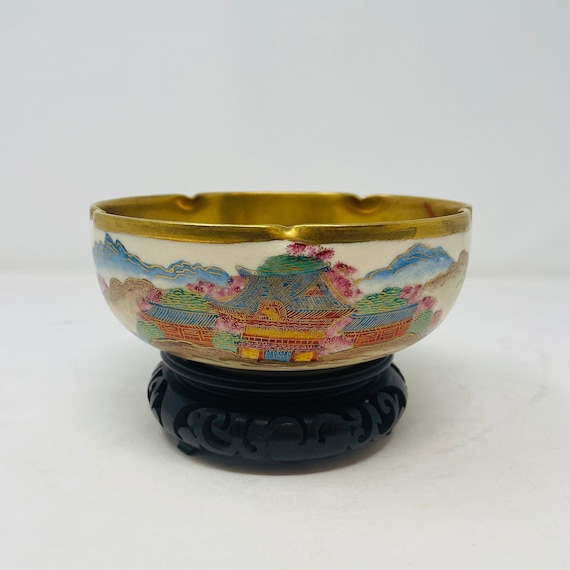
You are a GUI agent. You are given a task and a screenshot of the screen. Output one action in this format:
    pyautogui.click(x=<x>, y=<y>)
    Task: Click on the back wall
    Image resolution: width=570 pixels, height=570 pixels.
    Given the screenshot: What is the action you would take?
    pyautogui.click(x=48, y=183), pyautogui.click(x=300, y=52), pyautogui.click(x=522, y=226)